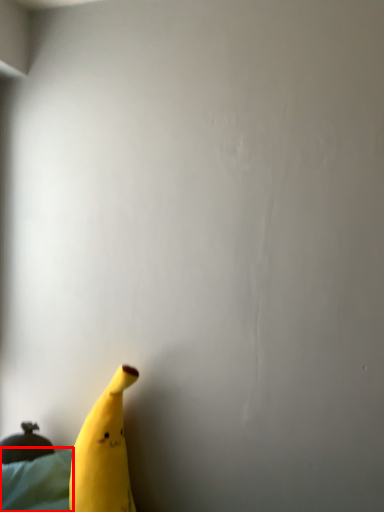
Question: From the image's perspective, what is the correct spatial relationship of sheet (annotated by the red box) in relation to banana?

Choices:
 (A) below
 (B) above

Answer: (A)